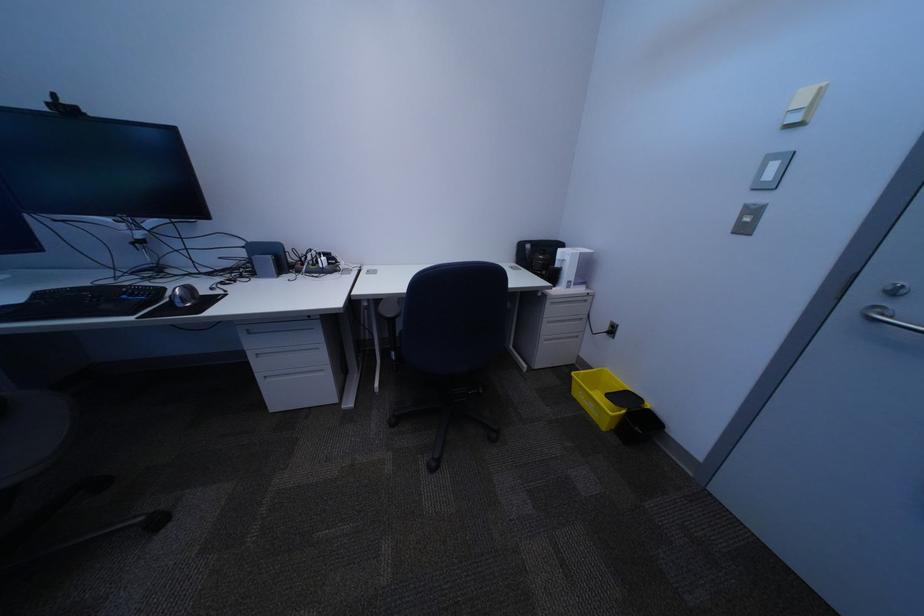
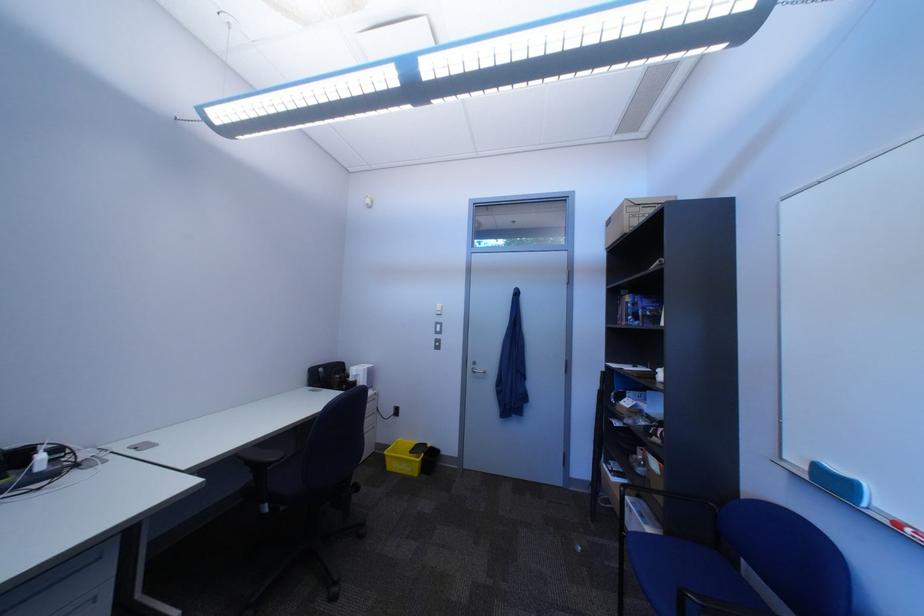
Locate, in the second image, the point that corresponds to (589,367) in the first image.

(388, 454)